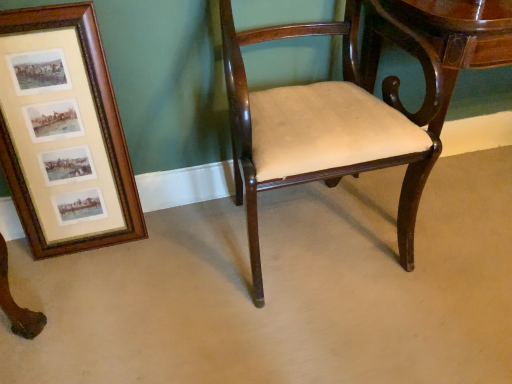
Where is `free space in front of mahogany wood chair at center`? free space in front of mahogany wood chair at center is located at coordinates (330, 335).